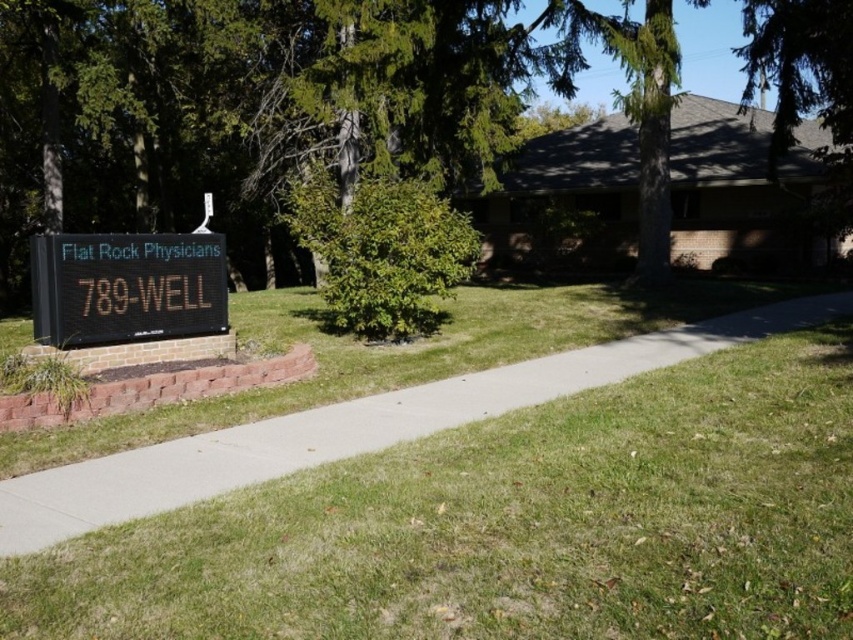
You are standing in front of the Flat Rock Physicians signboard and want to walk towards the building in the background. Which direction should you walk to move from point (184, 108) to point (282, 433)?

You should walk towards the building in the background because point (282, 433) is further away from you than point (184, 108).

You are a delivery driver approaching the Flat Rock Physicians building. You need to park your vehicle on the concrete at left. However, your vehicle has a height restriction of 6 feet. Can you safely park there without hitting the black digital sign at lower left?

The concrete at left is taller than the black digital sign at lower left. Since the concrete is taller, the sign is shorter than the concrete. If the concrete is tall enough to accommodate your vehicle, the sign being shorter means it won

You are a delivery driver approaching the Flat Rock Physicians building. You see a green leafy tree at center and a black digital sign at lower left. Which object is closer to the left side of the road?

The black digital sign at lower left is closer to the left side of the road because the green leafy tree at center is positioned to its right side.